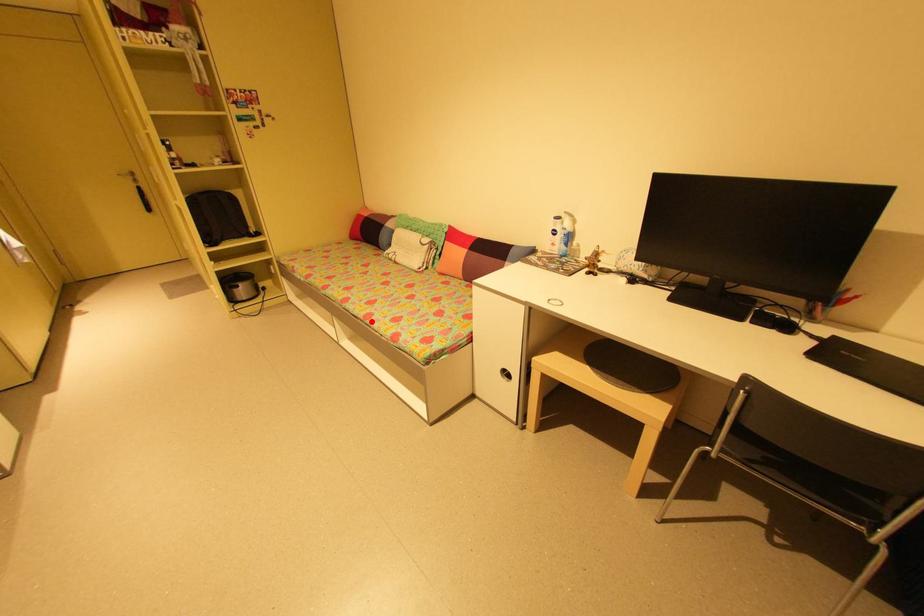
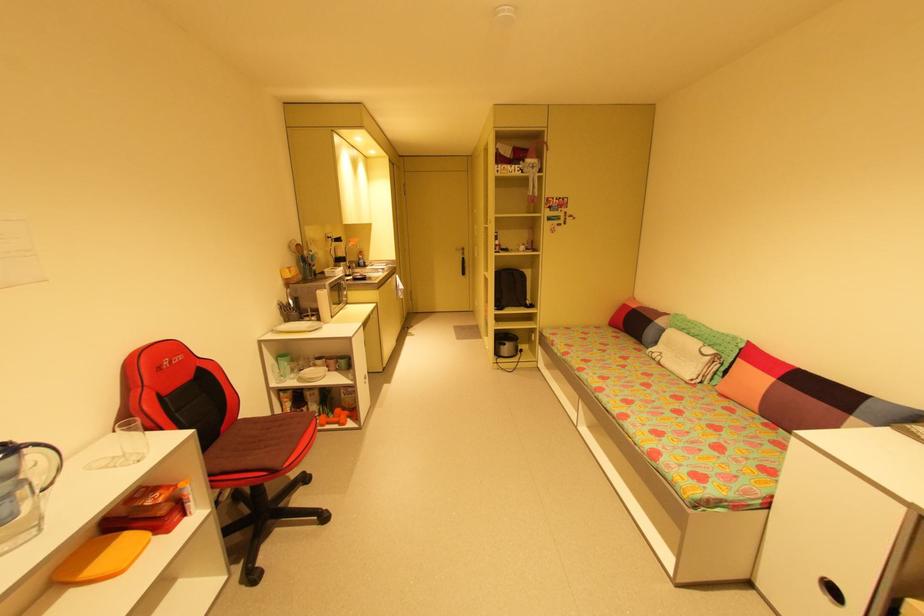
Question: I am providing you with two images of the same scene from different viewpoints. A red point is marked on the first image. At the location where the point appears in image 1, is it still visible in image 2?

Choices:
 (A) Yes
 (B) No

Answer: (A)